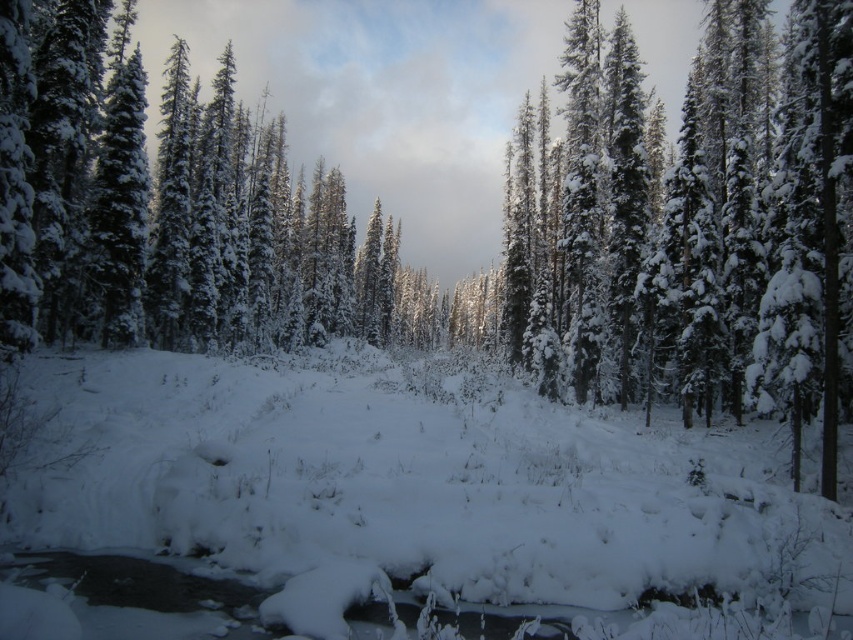
Question: Can you confirm if white fluffy snow at center is positioned to the left of green matte tree at center?

Choices:
 (A) yes
 (B) no

Answer: (A)

Question: Which point is closer to the camera?

Choices:
 (A) white fluffy snow at center
 (B) green matte tree at center

Answer: (A)

Question: Is white fluffy snow at center to the right of green matte tree at center from the viewer's perspective?

Choices:
 (A) yes
 (B) no

Answer: (B)

Question: Which of the following is the closest to the observer?

Choices:
 (A) green matte tree at center
 (B) white fluffy snow at center

Answer: (B)

Question: Does white fluffy snow at center appear on the right side of green matte tree at center?

Choices:
 (A) no
 (B) yes

Answer: (A)